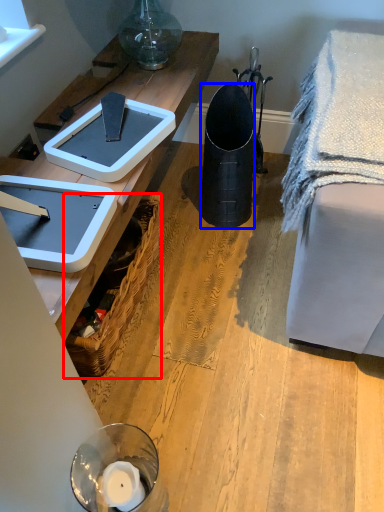
Question: Which object appears closest to the camera in this image, picnic basket (highlighted by a red box) or trash bin/can (highlighted by a blue box)?

Choices:
 (A) picnic basket
 (B) trash bin/can

Answer: (A)